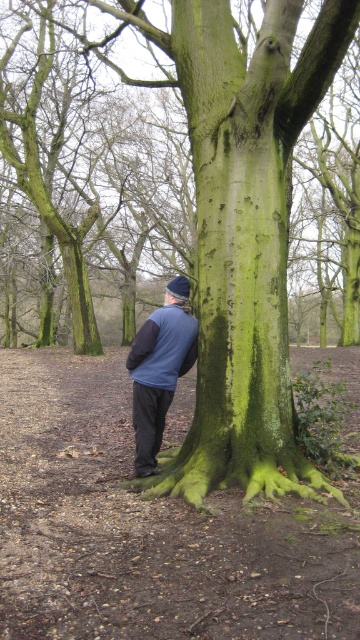
Is blue fleece jacket at center taller than blue fleece sweatshirt at lower center?

No, blue fleece jacket at center is not taller than blue fleece sweatshirt at lower center.

Which is behind, point (142, 330) or point (141, 364)?

The point (141, 364) is more distant.

Locate an element on the screen. blue fleece jacket at center is located at coordinates [159, 369].